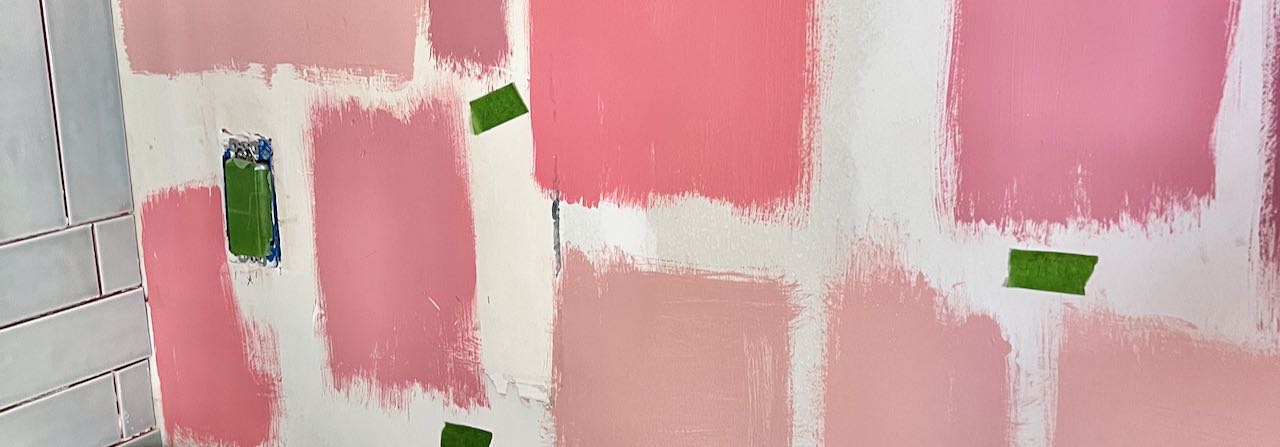
The height and width of the screenshot is (447, 1280). What are the coordinates of `vertical tiles` in the screenshot? It's located at (91, 171), (44, 185).